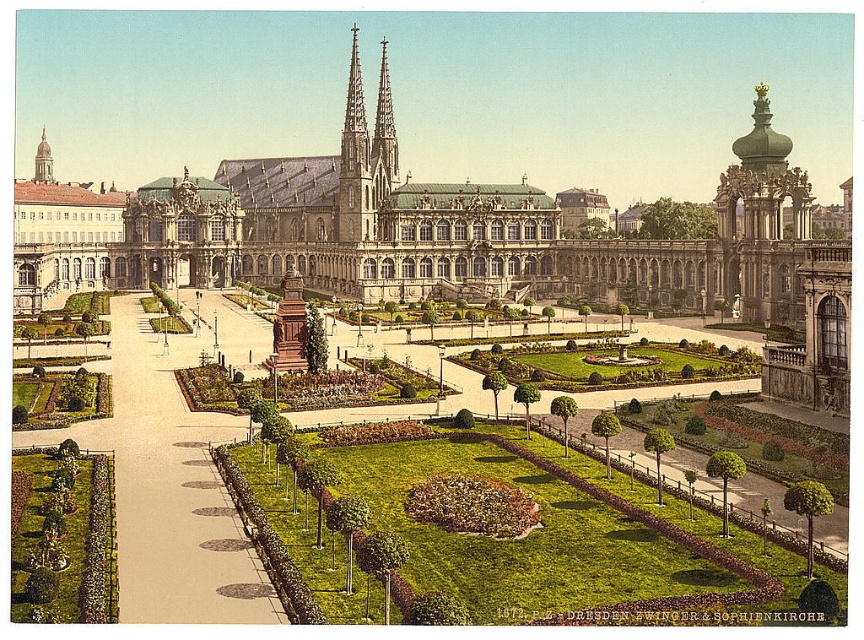
You are an architect designing a new garden pathway that must pass between the stone palace at center and the smooth stone spire at center. Given that the pathway must be at least 2 meters wide to accommodate visitors, can you determine if there is enough space between them based on their widths?

The stone palace at center is wider than the smooth stone spire at center. However, the exact widths are not provided, so it is impossible to determine if the 2 meter pathway requirement can be met between them.

In the scene shown: You are an architect visiting the grand complex and want to compare the two central stone structures. Which one is bigger between the stone palace at center and the smooth stone spire at center?

The stone palace at center is larger in size than the smooth stone spire at center, so the stone palace at center is bigger.